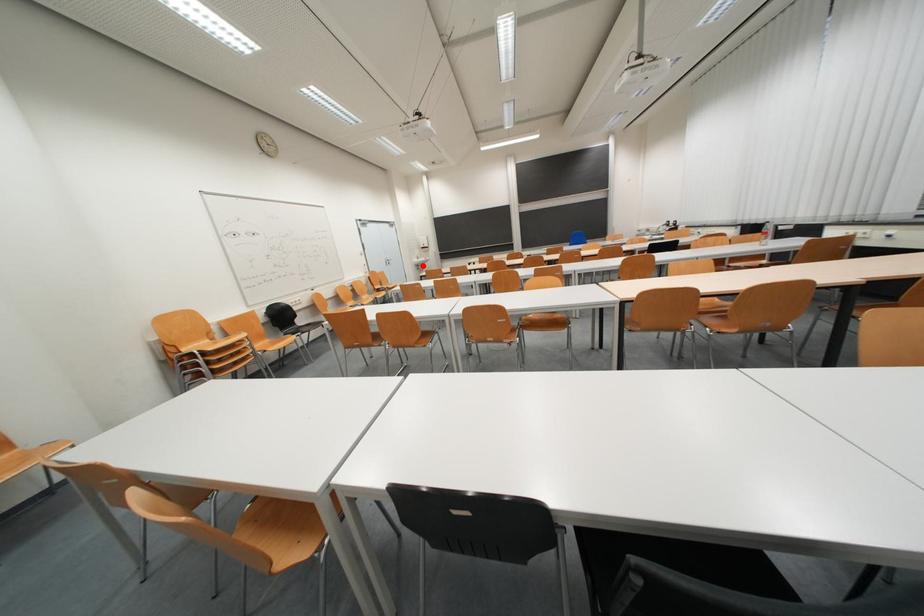
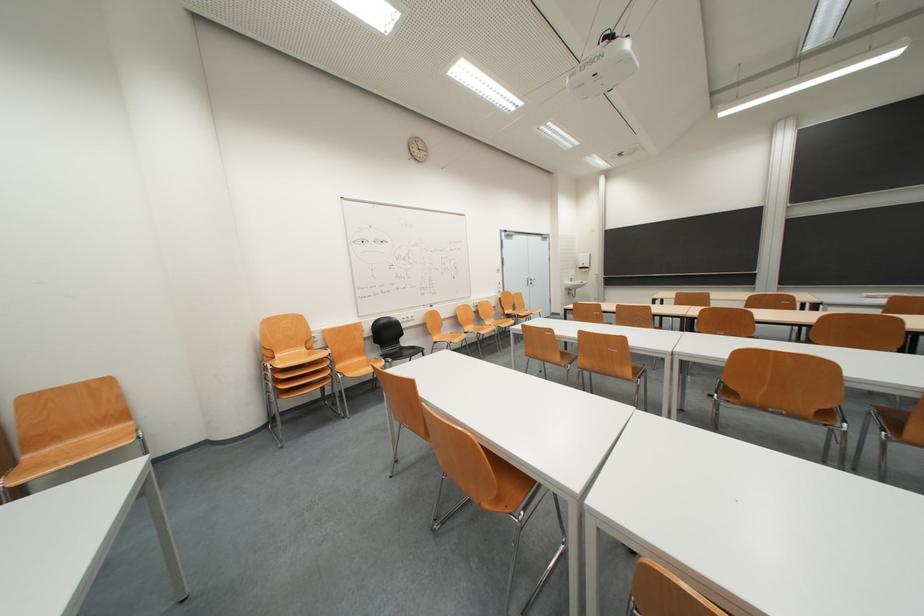
Question: I am providing you with two images of the same scene from different viewpoints. Image1 has a red point marked. In image2, the corresponding 3D location appears at what relative position? Reply with the corresponding letter.

Choices:
 (A) Closer
 (B) Farther

Answer: (A)